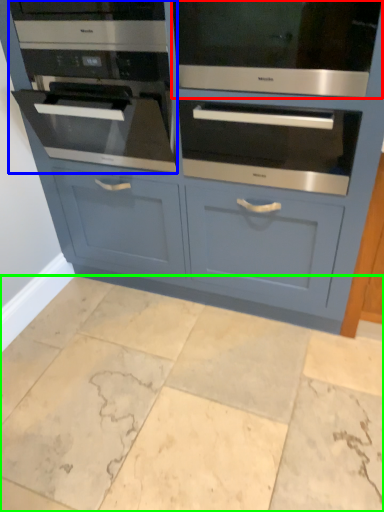
Question: Estimate the real-world distances between objects in this image. Which object is farther from oven (highlighted by a red box), oven (highlighted by a blue box) or ceramic tile (highlighted by a green box)?

Choices:
 (A) oven
 (B) ceramic tile

Answer: (B)